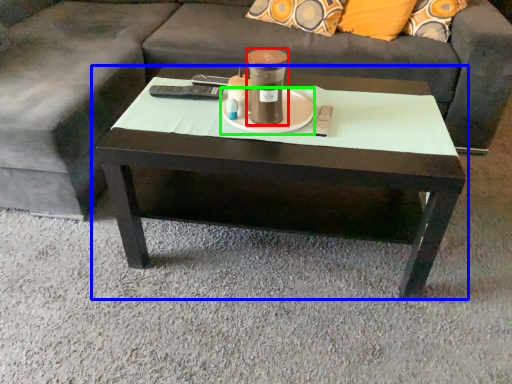
Question: Based on their relative distances, which object is nearer to beverage (highlighted by a red box)? Choose from coffee table (highlighted by a blue box) and saucer (highlighted by a green box).

Choices:
 (A) coffee table
 (B) saucer

Answer: (B)